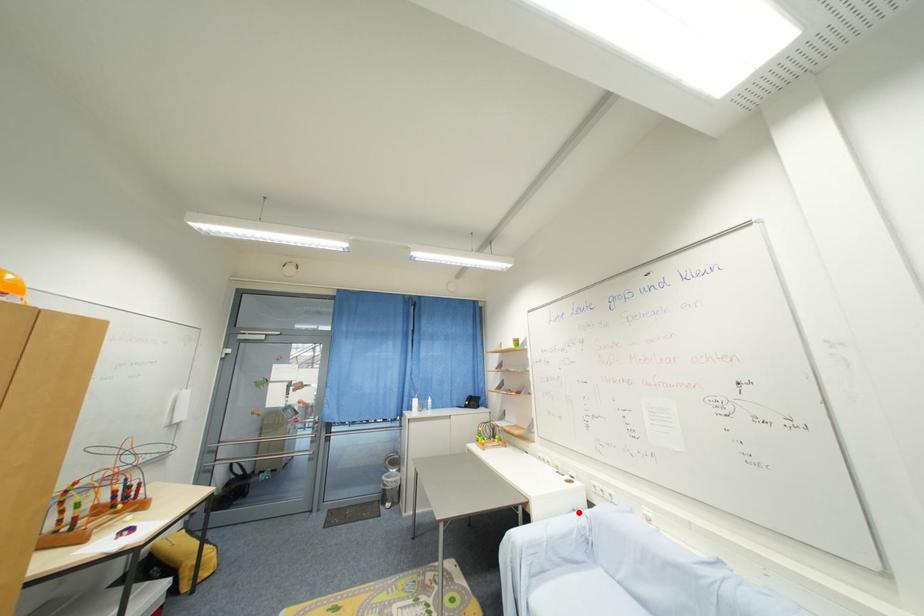
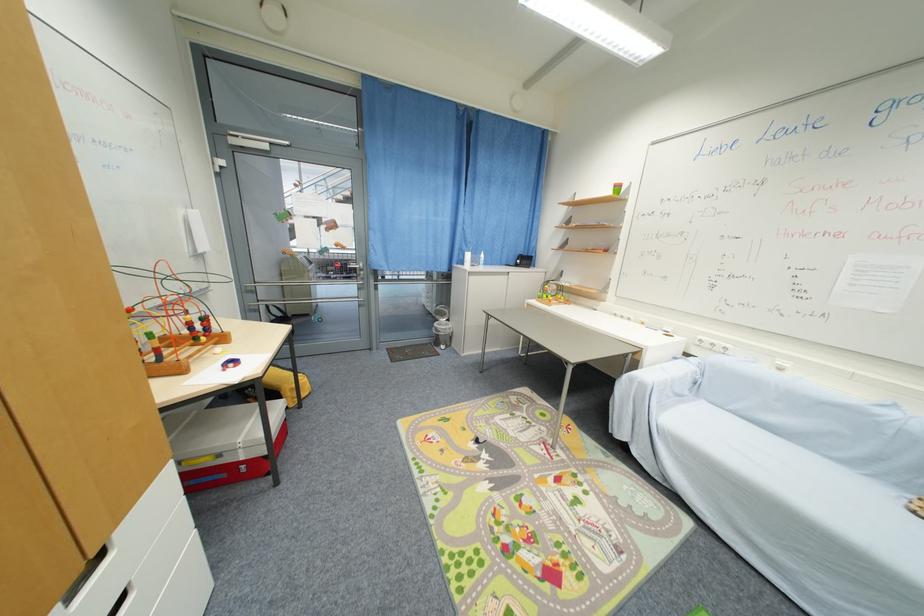
The point at the highlighted location is marked in the first image. Where is the corresponding point in the second image?

(681, 360)